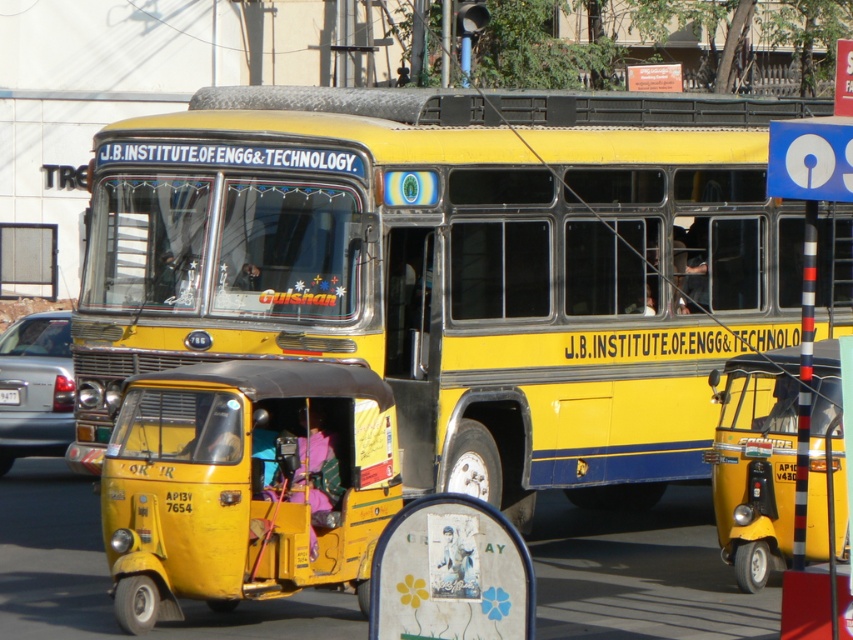
Does yellow matte taxi at lower left have a greater width compared to yellow matte auto-rickshaw at right?

Yes, yellow matte taxi at lower left is wider than yellow matte auto-rickshaw at right.

Is yellow matte taxi at lower left below yellow matte auto-rickshaw at right?

Actually, yellow matte taxi at lower left is above yellow matte auto-rickshaw at right.

Which is behind, point (338, 472) or point (815, 401)?

Point (815, 401)

At what (x,y) coordinates should I click in order to perform the action: click on yellow matte taxi at lower left. Please return your answer as a coordinate pair (x, y). Image resolution: width=853 pixels, height=640 pixels. Looking at the image, I should click on (245, 484).

What are the coordinates of `yellow matte taxi at lower left` in the screenshot? It's located at (245, 484).

Who is positioned more to the right, yellow matte taxi at lower left or yellow plastic license plate at center?

Positioned to the right is yellow matte taxi at lower left.

Locate an element on the screen. yellow matte taxi at lower left is located at coordinates (245, 484).

Between point (426, 424) and point (747, 573), which one is positioned behind?

The point (426, 424) is behind.

Does yellow matte bus at center have a greater height compared to yellow matte auto-rickshaw at right?

Yes, yellow matte bus at center is taller than yellow matte auto-rickshaw at right.

Is point (463, 381) positioned in front of point (819, 348)?

No, (463, 381) is further to viewer.

Where is `yellow matte bus at center`? The image size is (853, 640). yellow matte bus at center is located at coordinates (453, 268).